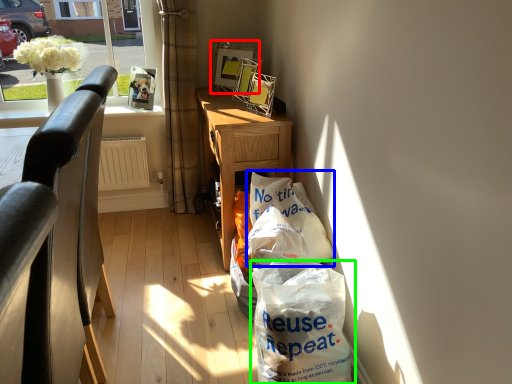
Question: Estimate the real-world distances between objects in this image. Which object is closer to picture frame (highlighted by a red box), grocery bag (highlighted by a blue box) or plastic bag (highlighted by a green box)?

Choices:
 (A) grocery bag
 (B) plastic bag

Answer: (A)